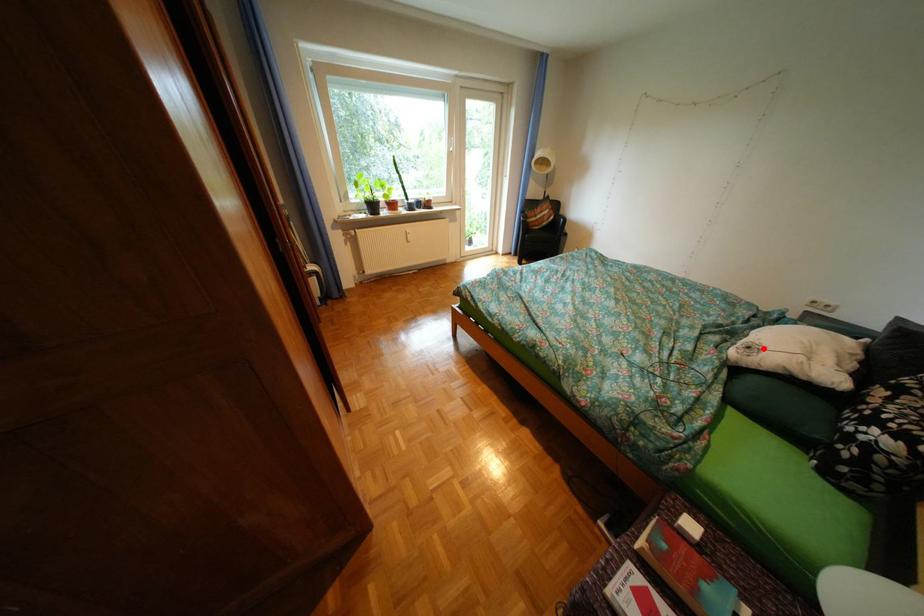
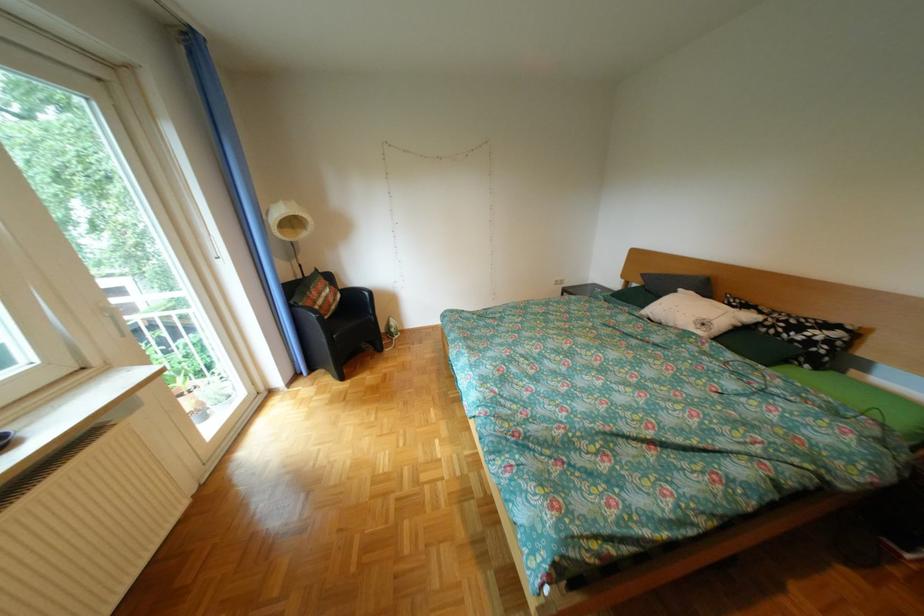
Where in the second image is the point corresponding to the highlighted location from the first image?

(718, 325)